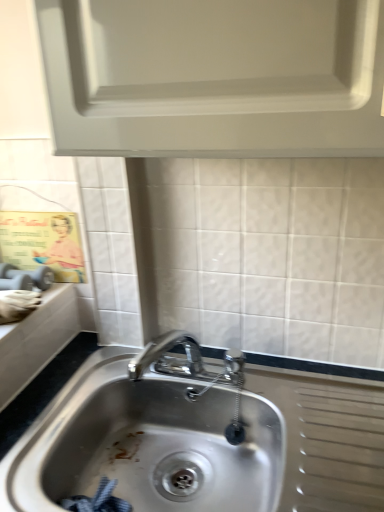
Find the location of a particular element. The image size is (384, 512). free point above stainless steel sink at center (from a real-world perspective) is located at coordinates (103, 381).